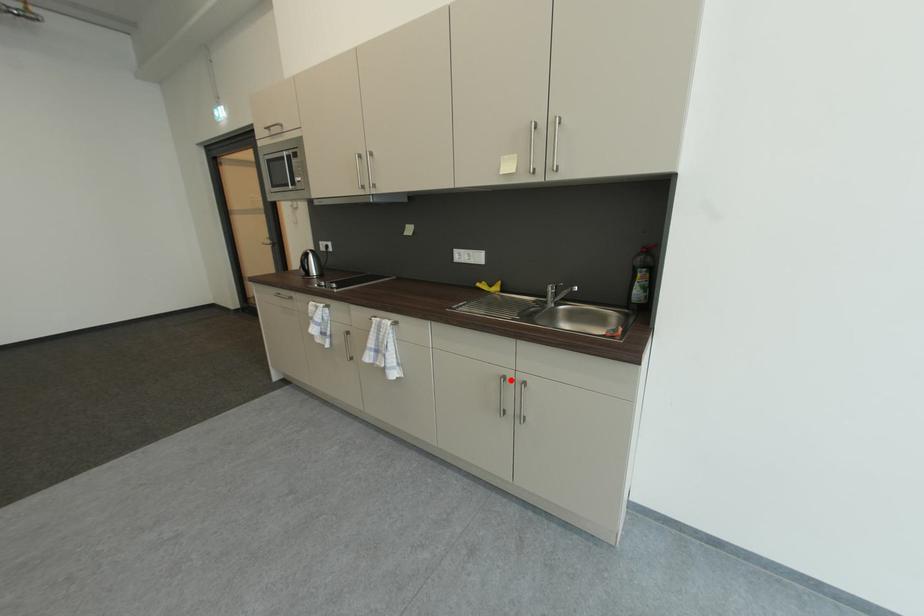
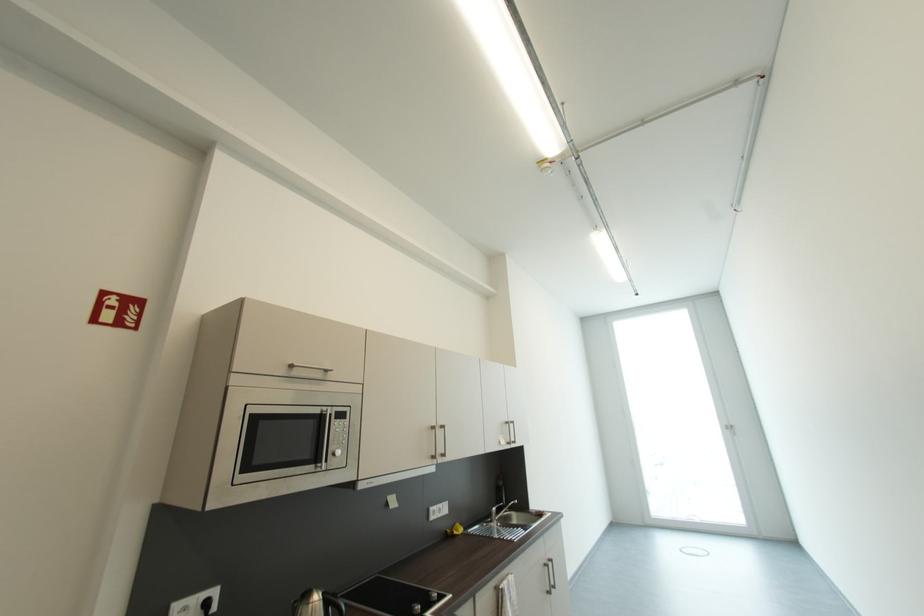
Where in the second image is the point corresponding to the highlighted location from the first image?

(552, 567)